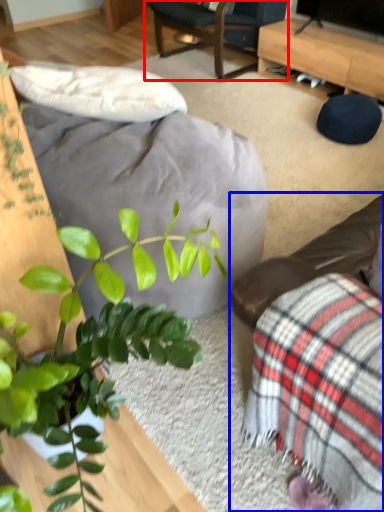
Question: Which of the following is the closest to the observer, chair (highlighted by a red box) or studio couch (highlighted by a blue box)?

Choices:
 (A) chair
 (B) studio couch

Answer: (B)